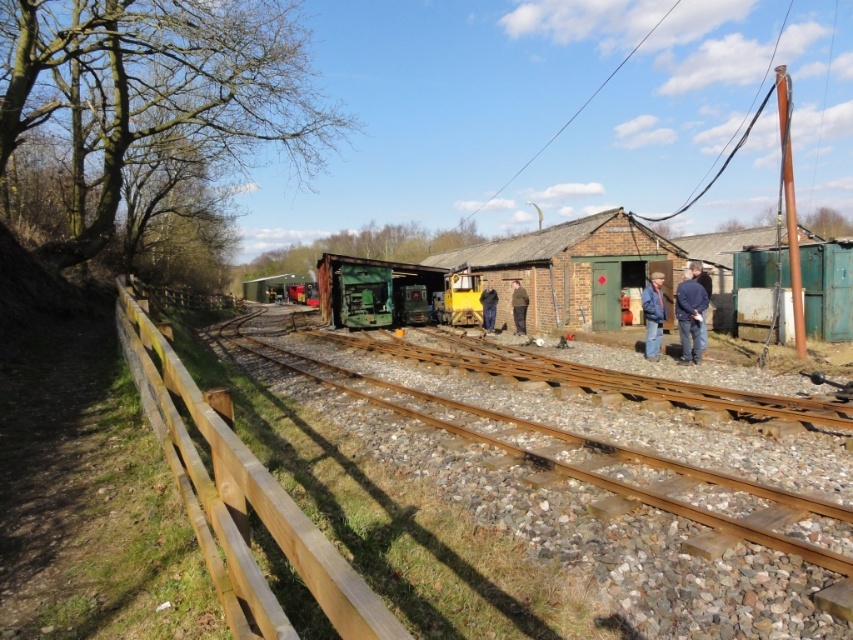
You are standing at point (514, 282) and want to walk to point (325, 376). Which direction should you move relative to the railway tracks?

You should move towards the front direction relative to the railway tracks because point (325, 376) is in front of point (514, 282) along the tracks.

You are a photographer standing at the wooden fence in the foreground. You want to capture both the rusty metal train track at center and the rusty green hut at right in your photo. Which object should you frame first if you want to include both in the same shot?

You should frame the rusty green hut at right first because the rusty metal train track at center is smaller in size, so it will fit into the frame more easily once the larger object is positioned.

You are a photographer standing at the railway scene. You notice a rusty metal train track at center and a brown leather jacket at center. Which object is bigger in size?

The rusty metal train track at center is larger in size than brown leather jacket at center.